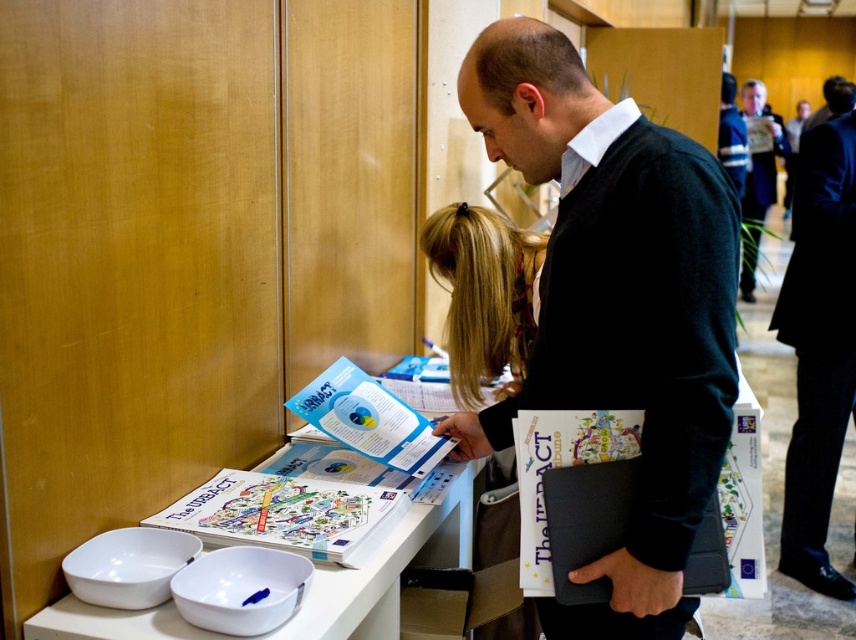
Question: Does black suit at right lie in front of dark blue suit at upper right?

Choices:
 (A) yes
 (B) no

Answer: (A)

Question: Among these objects, which one is farthest from the camera?

Choices:
 (A) black sweater at center
 (B) black suit at right

Answer: (B)

Question: Which object is the farthest from the dark blue suit at upper right?

Choices:
 (A) blonde hair at center
 (B) black sweater at center

Answer: (B)

Question: Is the position of black sweater at center less distant than that of black suit at right?

Choices:
 (A) yes
 (B) no

Answer: (A)

Question: Is black sweater at center closer to camera compared to dark blue suit at upper right?

Choices:
 (A) no
 (B) yes

Answer: (B)

Question: Which is nearer to the dark blue suit at upper right?

Choices:
 (A) black suit at right
 (B) black sweater at center

Answer: (A)